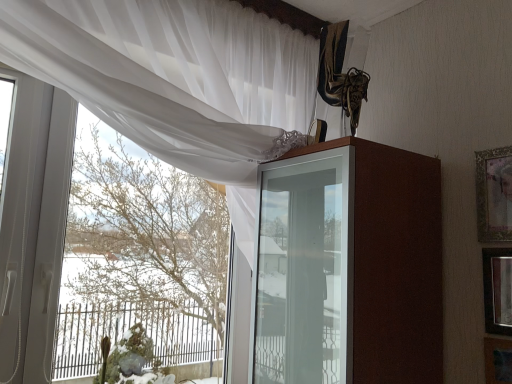
Measure the distance between point (334,319) and camera.

A distance of 1.04 meters exists between point (334,319) and camera.

Locate an element on the screen. brown glossy cabinet at upper center is located at coordinates (349, 266).

How much space does gold-framed picture at upper right, arranged as the 1th picture frame when viewed from the top, occupy vertically?

gold-framed picture at upper right, arranged as the 1th picture frame when viewed from the top, is 10.15 inches in height.

Describe the element at coordinates (177, 81) in the screenshot. This screenshot has height=384, width=512. I see `white sheer curtain at upper left` at that location.

Measure the distance between wooden framed mirror at right, the 2th picture frame viewed from the top, and camera.

1.11 meters.

What do you see at coordinates (497, 290) in the screenshot? The width and height of the screenshot is (512, 384). I see `wooden framed mirror at right, the 2th picture frame viewed from the top` at bounding box center [497, 290].

This screenshot has width=512, height=384. Find the location of `brown glossy cabinet at upper center`. brown glossy cabinet at upper center is located at coordinates (349, 266).

Is brown glossy cabinet at upper center oriented away from wooden framed mirror at right, the 2th picture frame viewed from the top?

No, brown glossy cabinet at upper center's orientation is not away from wooden framed mirror at right, the 2th picture frame viewed from the top.

Between point (378, 320) and point (510, 290), which one is positioned in front?

The point (378, 320) is closer to the camera.

Which picture frame is the 2nd one when counting from the right side of the brown glossy cabinet at upper center? Please provide its 2D coordinates.

[(497, 290)]

Is brown glossy cabinet at upper center touching wooden framed mirror at right, the second picture frame positioned from the bottom?

No.

Does wooden framed mirror at right, the 2th picture frame viewed from the top, have a lesser width compared to gold-framed picture at upper right, arranged as the 1th picture frame when viewed from the top?

Indeed, wooden framed mirror at right, the 2th picture frame viewed from the top, has a lesser width compared to gold-framed picture at upper right, arranged as the 1th picture frame when viewed from the top.

From a real-world perspective, relative to gold-framed picture at upper right, which is counted as the third picture frame, starting from the bottom, is wooden framed mirror at right, the 2th picture frame viewed from the top, vertically above or below?

In terms of real-world spatial position, wooden framed mirror at right, the 2th picture frame viewed from the top, is below gold-framed picture at upper right, which is counted as the third picture frame, starting from the bottom.

Which is behind, wooden framed mirror at right, the 2th picture frame viewed from the top, or gold-framed picture at upper right, arranged as the 1th picture frame when viewed from the top?

gold-framed picture at upper right, arranged as the 1th picture frame when viewed from the top, is further from the camera.

Does wooden framed mirror at right, the 2th picture frame viewed from the top, have a greater height compared to gold-framed picture at upper right, which is counted as the third picture frame, starting from the bottom?

In fact, wooden framed mirror at right, the 2th picture frame viewed from the top, may be shorter than gold-framed picture at upper right, which is counted as the third picture frame, starting from the bottom.

From a real-world perspective, is white sheer curtain at upper left under wooden framed mirror at right, the 2th picture frame viewed from the top?

Actually, white sheer curtain at upper left is physically above wooden framed mirror at right, the 2th picture frame viewed from the top, in the real world.

Does white sheer curtain at upper left have a greater width compared to wooden framed mirror at right, the 2th picture frame viewed from the top?

Indeed, white sheer curtain at upper left has a greater width compared to wooden framed mirror at right, the 2th picture frame viewed from the top.

Would you say white sheer curtain at upper left is a long distance from wooden framed mirror at right, the 2th picture frame viewed from the top?

No, white sheer curtain at upper left is not far from wooden framed mirror at right, the 2th picture frame viewed from the top.

From the image's perspective, is white sheer curtain at upper left located above or below wooden framed mirror at right, the 2th picture frame viewed from the top?

Based on their image positions, white sheer curtain at upper left is located above wooden framed mirror at right, the 2th picture frame viewed from the top.

Considering their positions, is brown glossy cabinet at upper center located in front of or behind wooden picture frame at lower right, the 3th picture frame positioned from the top?

Visually, brown glossy cabinet at upper center is located in front of wooden picture frame at lower right, the 3th picture frame positioned from the top.

From a real-world perspective, does brown glossy cabinet at upper center sit lower than wooden picture frame at lower right, the 3th picture frame positioned from the top?

No, from a real-world perspective, brown glossy cabinet at upper center is not under wooden picture frame at lower right, the 3th picture frame positioned from the top.

Which is farther, (321, 348) or (499, 378)?

The point (499, 378) is farther from the camera.

Is brown glossy cabinet at upper center facing towards wooden picture frame at lower right, the 3th picture frame positioned from the top?

No, brown glossy cabinet at upper center is not oriented towards wooden picture frame at lower right, the 3th picture frame positioned from the top.

Measure the distance from wooden framed mirror at right, the 2th picture frame viewed from the top, to wooden picture frame at lower right, the 3th picture frame positioned from the top.

They are 4.31 inches apart.

Considering the sizes of objects wooden framed mirror at right, the second picture frame positioned from the bottom, and wooden picture frame at lower right, arranged as the 1th picture frame when ordered from the bottom, in the image provided, who is bigger, wooden framed mirror at right, the second picture frame positioned from the bottom, or wooden picture frame at lower right, arranged as the 1th picture frame when ordered from the bottom,?

wooden framed mirror at right, the second picture frame positioned from the bottom.

From a real-world perspective, does wooden framed mirror at right, the second picture frame positioned from the bottom, sit lower than wooden picture frame at lower right, arranged as the 1th picture frame when ordered from the bottom?

Actually, wooden framed mirror at right, the second picture frame positioned from the bottom, is physically above wooden picture frame at lower right, arranged as the 1th picture frame when ordered from the bottom, in the real world.

Can you confirm if wooden framed mirror at right, the second picture frame positioned from the bottom, is wider than wooden picture frame at lower right, arranged as the 1th picture frame when ordered from the bottom?

In fact, wooden framed mirror at right, the second picture frame positioned from the bottom, might be narrower than wooden picture frame at lower right, arranged as the 1th picture frame when ordered from the bottom.

Is white sheer curtain at upper left completely or partially inside brown glossy cabinet at upper center?

Definitely not — white sheer curtain at upper left is not inside brown glossy cabinet at upper center.

Is brown glossy cabinet at upper center wider than white sheer curtain at upper left?

Yes, brown glossy cabinet at upper center is wider than white sheer curtain at upper left.

Is brown glossy cabinet at upper center oriented away from white sheer curtain at upper left?

Yes, brown glossy cabinet at upper center's orientation is away from white sheer curtain at upper left.

Is there a large distance between brown glossy cabinet at upper center and white sheer curtain at upper left?

No, brown glossy cabinet at upper center is not far from white sheer curtain at upper left.

Looking at this image, considering the relative sizes of wooden framed mirror at right, the second picture frame positioned from the bottom, and brown glossy cabinet at upper center in the image provided, is wooden framed mirror at right, the second picture frame positioned from the bottom, thinner than brown glossy cabinet at upper center?

Indeed, wooden framed mirror at right, the second picture frame positioned from the bottom, has a lesser width compared to brown glossy cabinet at upper center.

Which of these two, wooden framed mirror at right, the 2th picture frame viewed from the top, or brown glossy cabinet at upper center, stands taller?

With more height is brown glossy cabinet at upper center.

From the image's perspective, is wooden framed mirror at right, the second picture frame positioned from the bottom, below brown glossy cabinet at upper center?

Actually, wooden framed mirror at right, the second picture frame positioned from the bottom, appears above brown glossy cabinet at upper center in the image.

From the brown glossy cabinet at upper center, count 2nd picture frames backward and point to it. Please provide its 2D coordinates.

[(497, 290)]

At what (x,y) coordinates should I click in order to perform the action: click on picture frame that is the 1st object located in front of the gold-framed picture at upper right, which is counted as the third picture frame, starting from the bottom. Please return your answer as a coordinate pair (x, y). Looking at the image, I should click on (497, 290).

Estimate the real-world distances between objects in this image. Which object is closer to wooden framed mirror at right, the second picture frame positioned from the bottom, white sheer curtain at upper left or brown glossy cabinet at upper center?

Among the two, brown glossy cabinet at upper center is located nearer to wooden framed mirror at right, the second picture frame positioned from the bottom.

When comparing their distances from wooden framed mirror at right, the 2th picture frame viewed from the top, does wooden picture frame at lower right, the 3th picture frame positioned from the top, or green mossy plant at lower left seem further?

Among the two, green mossy plant at lower left is located further to wooden framed mirror at right, the 2th picture frame viewed from the top.

Which object lies nearer to the anchor point wooden picture frame at lower right, arranged as the 1th picture frame when ordered from the bottom, white sheer curtain at upper left or gold-framed picture at upper right, arranged as the 1th picture frame when viewed from the top?

gold-framed picture at upper right, arranged as the 1th picture frame when viewed from the top.

Which object lies nearer to the anchor point green mossy plant at lower left, brown glossy cabinet at upper center or white sheer curtain at upper left?

brown glossy cabinet at upper center.

From the picture: When comparing their distances from white sheer curtain at upper left, does green mossy plant at lower left or brown glossy cabinet at upper center seem further?

Based on the image, green mossy plant at lower left appears to be further to white sheer curtain at upper left.

Considering their positions, is brown glossy cabinet at upper center positioned further to gold-framed picture at upper right, arranged as the 1th picture frame when viewed from the top, than green mossy plant at lower left?

The object further to gold-framed picture at upper right, arranged as the 1th picture frame when viewed from the top, is green mossy plant at lower left.

Which object lies nearer to the anchor point brown glossy cabinet at upper center, white sheer curtain at upper left or green mossy plant at lower left?

The object closer to brown glossy cabinet at upper center is white sheer curtain at upper left.

When comparing their distances from green mossy plant at lower left, does white sheer curtain at upper left or wooden picture frame at lower right, the 3th picture frame positioned from the top, seem closer?

The object closer to green mossy plant at lower left is white sheer curtain at upper left.

This screenshot has width=512, height=384. What are the coordinates of `dresser between green mossy plant at lower left and gold-framed picture at upper right, which is counted as the third picture frame, starting from the bottom` in the screenshot? It's located at (349, 266).

Locate an element on the screen. Image resolution: width=512 pixels, height=384 pixels. picture frame situated between green mossy plant at lower left and wooden framed mirror at right, the second picture frame positioned from the bottom, from left to right is located at coordinates (498, 360).

You are a GUI agent. You are given a task and a screenshot of the screen. Output one action in this format:
    pyautogui.click(x=<x>, y=<y>)
    Task: Click on the dresser located between white sheer curtain at upper left and wooden picture frame at lower right, the 3th picture frame positioned from the top, in the left-right direction
    This screenshot has height=384, width=512.
    Given the screenshot: What is the action you would take?
    pyautogui.click(x=349, y=266)

At what (x,y) coordinates should I click in order to perform the action: click on dresser located between green mossy plant at lower left and wooden framed mirror at right, the 2th picture frame viewed from the top, in the left-right direction. Please return your answer as a coordinate pair (x, y). The width and height of the screenshot is (512, 384). Looking at the image, I should click on 349,266.